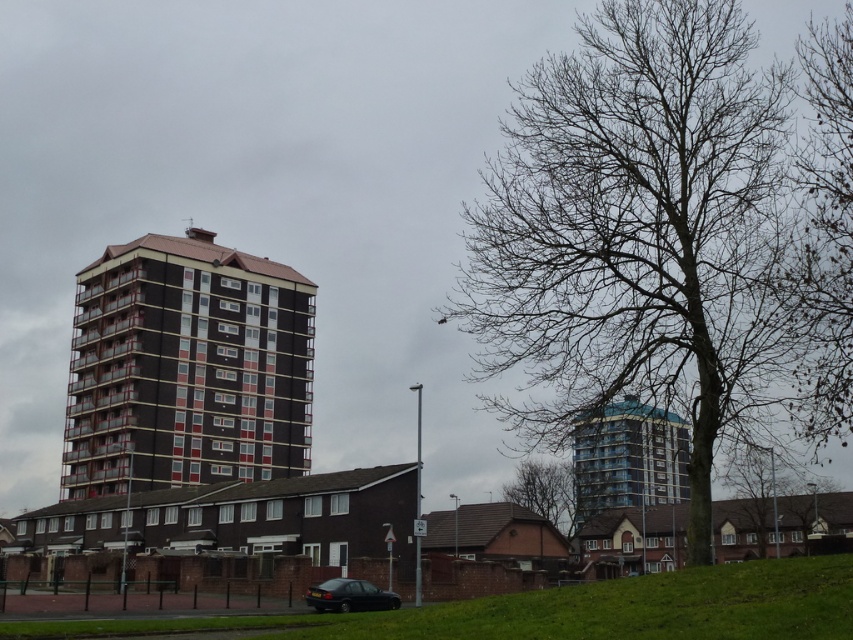
Question: Does brown glossy building at center have a lesser width compared to bare branches at right?

Choices:
 (A) yes
 (B) no

Answer: (A)

Question: Which object is farther from the camera taking this photo?

Choices:
 (A) brown glossy building at center
 (B) blue glass building at center

Answer: (A)

Question: Can you confirm if blue glass building at center is positioned below matte black sedan at lower center?

Choices:
 (A) yes
 (B) no

Answer: (A)

Question: Can you confirm if bare wood tree at center is wider than matte black sedan at lower center?

Choices:
 (A) yes
 (B) no

Answer: (A)

Question: Which is farther from the bare wood tree at center?

Choices:
 (A) brown glossy building at center
 (B) green grass at lower center

Answer: (A)

Question: Estimate the real-world distances between objects in this image. Which object is closer to the green grass at lower center?

Choices:
 (A) bare branches at right
 (B) bare wood tree at center
 (C) blue glass building at center

Answer: (B)